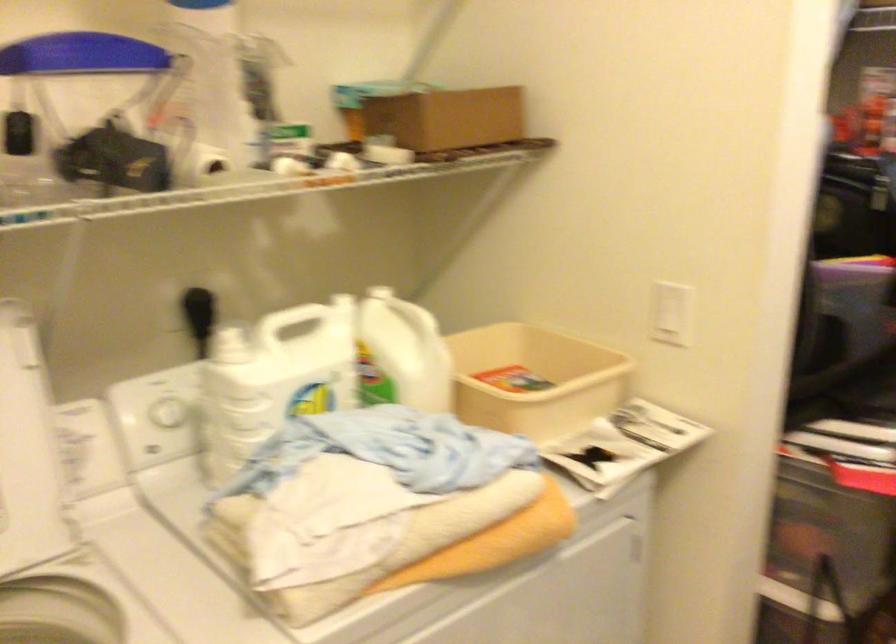
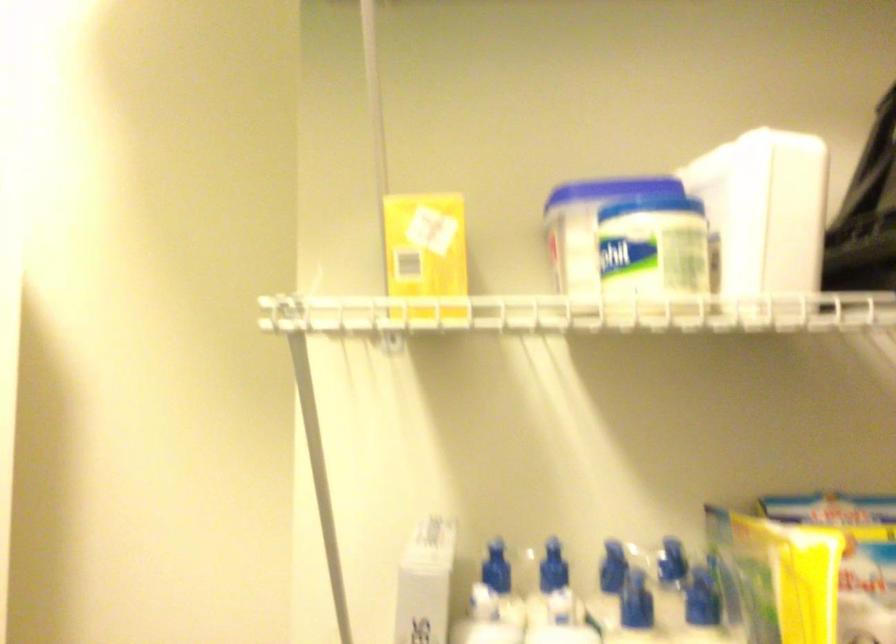
Question: The images are taken continuously from a first-person perspective. In which direction is your viewpoint rotating?

Choices:
 (A) Left
 (B) Right
 (C) Up
 (D) Down

Answer: (B)